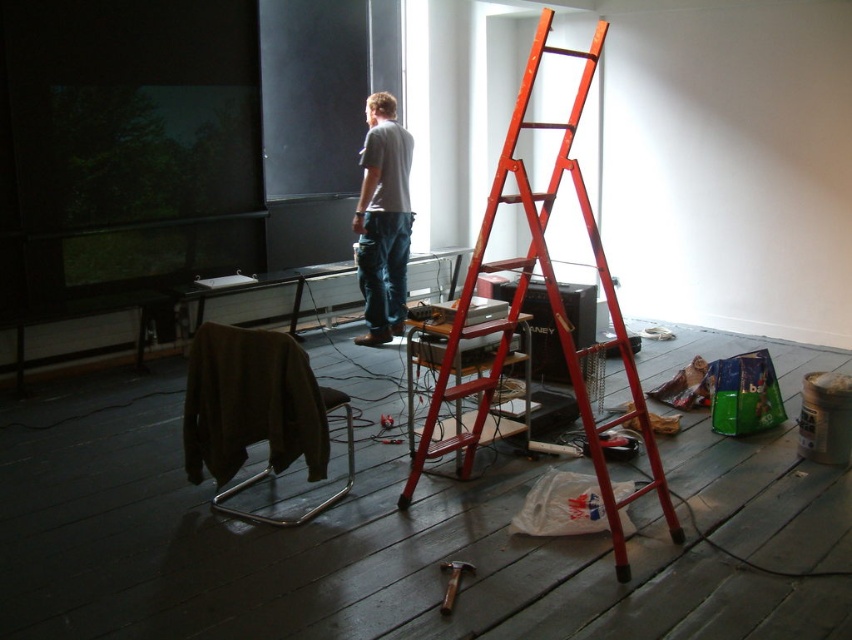
Measure the distance between gray cotton shirt at center and wooden hammer at center.

gray cotton shirt at center and wooden hammer at center are 3.12 meters apart from each other.

Who is taller, gray cotton shirt at center or wooden hammer at center?

gray cotton shirt at center

This screenshot has width=852, height=640. Describe the element at coordinates (383, 220) in the screenshot. I see `gray cotton shirt at center` at that location.

Find the location of a particular element. This screenshot has height=640, width=852. gray cotton shirt at center is located at coordinates (383, 220).

Based on the photo, between orange metallic ladder at center and wooden hammer at center, which one has less height?

wooden hammer at center

Can you confirm if orange metallic ladder at center is positioned to the right of wooden hammer at center?

Yes, orange metallic ladder at center is to the right of wooden hammer at center.

Which is in front, point (611, 308) or point (459, 563)?

Positioned in front is point (459, 563).

Where is `orange metallic ladder at center`? The width and height of the screenshot is (852, 640). orange metallic ladder at center is located at coordinates (548, 307).

The height and width of the screenshot is (640, 852). Describe the element at coordinates (548, 307) in the screenshot. I see `orange metallic ladder at center` at that location.

Locate an element on the screen. Image resolution: width=852 pixels, height=640 pixels. orange metallic ladder at center is located at coordinates (548, 307).

Locate an element on the screen. This screenshot has width=852, height=640. orange metallic ladder at center is located at coordinates (548, 307).